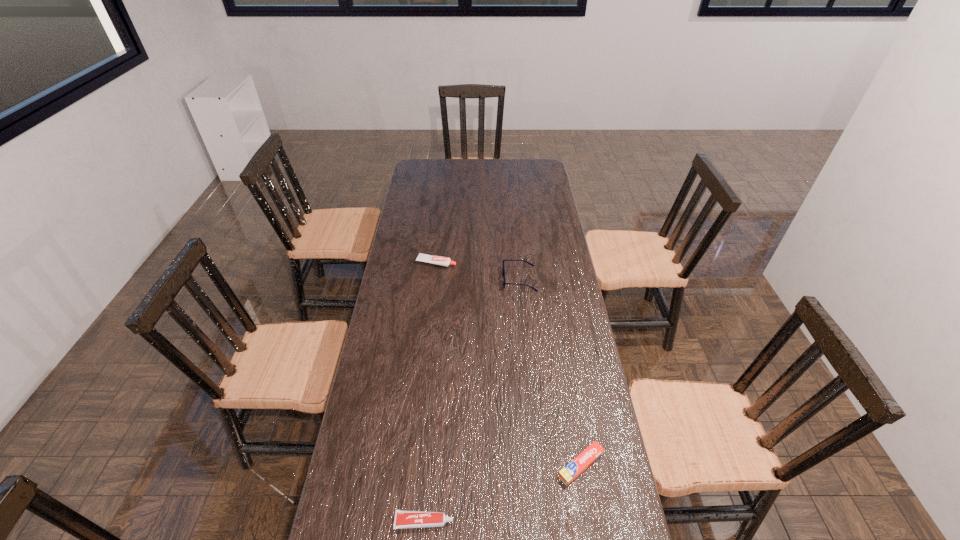
The image size is (960, 540). Identify the location of the tallest object. (503, 260).

Locate an element on the screen. the second tallest object is located at coordinates (438, 260).

Image resolution: width=960 pixels, height=540 pixels. In order to click on the tallest toothpaste in this screenshot , I will do `click(438, 260)`.

The width and height of the screenshot is (960, 540). I want to click on the nearest object, so click(x=403, y=519).

Where is `the second nearest toothpaste`? the second nearest toothpaste is located at coordinates (571, 471).

Find the location of `the third farthest object`. the third farthest object is located at coordinates (571, 471).

Find the location of a particular element. The image size is (960, 540). free space located on the front-facing side of the spectacles is located at coordinates (468, 279).

Locate an element on the screen. free space located 0.090m on the front-facing side of the spectacles is located at coordinates (480, 279).

Where is `vacant space located on the front-facing side of the spectacles`? The width and height of the screenshot is (960, 540). vacant space located on the front-facing side of the spectacles is located at coordinates (488, 279).

This screenshot has width=960, height=540. I want to click on vacant space located on the right of the third shortest object, so click(534, 262).